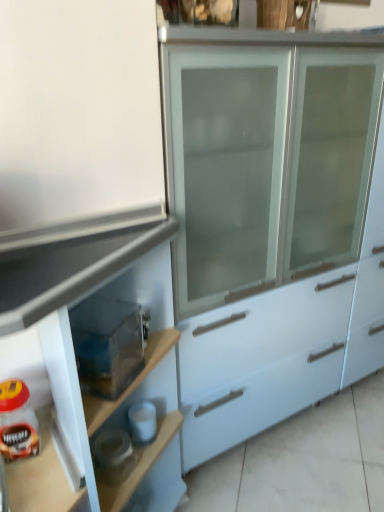
This screenshot has height=512, width=384. What do you see at coordinates (17, 422) in the screenshot? I see `matte glass jar of coffee at lower left` at bounding box center [17, 422].

The image size is (384, 512). In order to click on matte white cabinet at center in this screenshot , I will do `click(78, 110)`.

Locate an element on the screen. matte glass jar of coffee at lower left is located at coordinates (17, 422).

Can you confirm if transparent plastic container at lower left is shorter than matte white cabinet at center?

Yes, transparent plastic container at lower left is shorter than matte white cabinet at center.

Is there a large distance between transparent plastic container at lower left and matte white cabinet at center?

They are positioned close to each other.

From a real-world perspective, between transparent plastic container at lower left and matte white cabinet at center, who is vertically lower?

matte white cabinet at center.

The image size is (384, 512). Find the location of `cabinetry in front of the transparent plastic container at lower left`. cabinetry in front of the transparent plastic container at lower left is located at coordinates (78, 110).

Consider the image. Which is more to the left, matte white cabinet at center or matte glass jar of coffee at lower left?

matte glass jar of coffee at lower left.

Is matte white cabinet at center facing away from matte glass jar of coffee at lower left?

Yes, matte white cabinet at center is facing away from matte glass jar of coffee at lower left.

From a real-world perspective, is matte white cabinet at center below matte glass jar of coffee at lower left?

Yes, from a real-world perspective, matte white cabinet at center is below matte glass jar of coffee at lower left.

Which of these two, matte white cabinet at center or matte glass jar of coffee at lower left, is wider?

Wider between the two is matte white cabinet at center.

Considering the positions of points (143, 339) and (8, 438), is point (143, 339) closer to camera compared to point (8, 438)?

No, (143, 339) is behind (8, 438).

Is transparent plastic container at lower left facing towards matte glass jar of coffee at lower left?

No, transparent plastic container at lower left is not turned towards matte glass jar of coffee at lower left.

How much distance is there between transparent plastic container at lower left and matte glass jar of coffee at lower left?

The distance of transparent plastic container at lower left from matte glass jar of coffee at lower left is 8.52 inches.

How many degrees apart are the facing directions of transparent plastic container at lower left and matte glass jar of coffee at lower left?

They differ by 45.2 degrees in their facing directions.

From the image's perspective, which is above, matte glass jar of coffee at lower left or matte white cabinet at center?

matte glass jar of coffee at lower left appears higher in the image.

From a real-world perspective, is matte glass jar of coffee at lower left located beneath matte white cabinet at center?

Actually, matte glass jar of coffee at lower left is physically above matte white cabinet at center in the real world.

What are the coordinates of `food above the matte white cabinet at center (from a real-world perspective)` in the screenshot? It's located at (17, 422).

Is matte glass jar of coffee at lower left positioned behind matte white cabinet at center?

That is True.

Could you tell me if matte glass jar of coffee at lower left is turned towards transparent plastic container at lower left?

No, matte glass jar of coffee at lower left does not turn towards transparent plastic container at lower left.

Between point (30, 422) and point (83, 386), which one is positioned in front?

The point (83, 386) is closer to the camera.

From a real-world perspective, is matte glass jar of coffee at lower left positioned over transparent plastic container at lower left based on gravity?

Incorrect, from a real-world perspective, matte glass jar of coffee at lower left is lower than transparent plastic container at lower left.

Locate an element on the screen. The height and width of the screenshot is (512, 384). appliance that is above the matte glass jar of coffee at lower left (from a real-world perspective) is located at coordinates (107, 344).

Consider the image. From a real-world perspective, is matte white cabinet at center positioned over transparent plastic container at lower left based on gravity?

No, from a real-world perspective, matte white cabinet at center is not over transparent plastic container at lower left

Considering the sizes of objects matte white cabinet at center and transparent plastic container at lower left in the image provided, who is bigger, matte white cabinet at center or transparent plastic container at lower left?

With larger size is matte white cabinet at center.

Is the depth of matte white cabinet at center less than that of transparent plastic container at lower left?

Yes, the depth of matte white cabinet at center is less than that of transparent plastic container at lower left.

How distant is matte white cabinet at center from transparent plastic container at lower left?

The distance of matte white cabinet at center from transparent plastic container at lower left is 15.09 inches.

This screenshot has height=512, width=384. I want to click on appliance positioned vertically above the matte white cabinet at center (from a real-world perspective), so click(x=107, y=344).

The width and height of the screenshot is (384, 512). I want to click on cabinetry located below the matte glass jar of coffee at lower left (from the image's perspective), so click(x=78, y=110).

Estimate the real-world distances between objects in this image. Which object is closer to matte white cabinet at center, matte glass jar of coffee at lower left or transparent plastic container at lower left?

Among the two, transparent plastic container at lower left is located nearer to matte white cabinet at center.

From the image, which object appears to be farther from matte white cabinet at center, transparent plastic container at lower left or matte glass jar of coffee at lower left?

The object further to matte white cabinet at center is matte glass jar of coffee at lower left.

Estimate the real-world distances between objects in this image. Which object is further from transparent plastic container at lower left, matte glass jar of coffee at lower left or matte white cabinet at center?

matte white cabinet at center.

Based on their spatial positions, is transparent plastic container at lower left or matte white cabinet at center closer to matte glass jar of coffee at lower left?

transparent plastic container at lower left lies closer to matte glass jar of coffee at lower left than the other object.

Estimate the real-world distances between objects in this image. Which object is closer to matte glass jar of coffee at lower left, matte white cabinet at center or transparent plastic container at lower left?

Based on the image, transparent plastic container at lower left appears to be nearer to matte glass jar of coffee at lower left.

Looking at the image, which one is located closer to transparent plastic container at lower left, matte white cabinet at center or matte glass jar of coffee at lower left?

matte glass jar of coffee at lower left is closer to transparent plastic container at lower left.

Locate an element on the screen. appliance between matte white cabinet at center and matte glass jar of coffee at lower left from front to back is located at coordinates (107, 344).